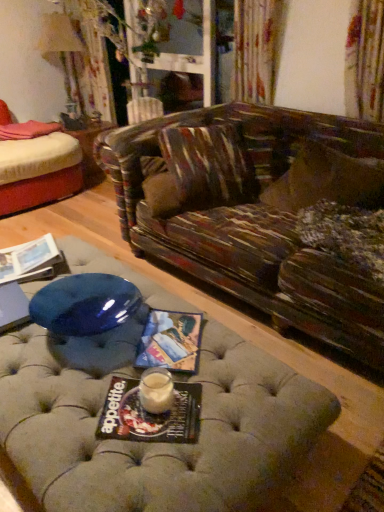
I want to click on empty space that is ontop of matte paper magazine at center, the 2th magazine in the bottom-to-top sequence (from a real-world perspective), so click(x=168, y=334).